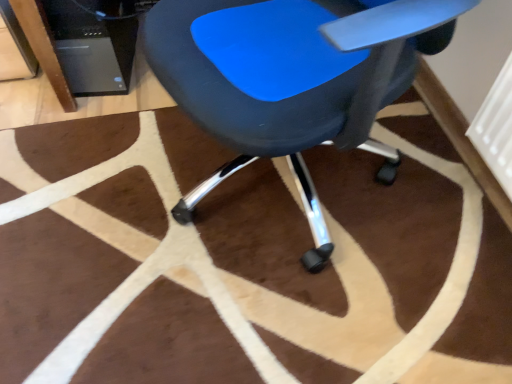
Question: Does blue plastic chair at center contain black plastic computer tower at upper left?

Choices:
 (A) no
 (B) yes

Answer: (A)

Question: Can you confirm if blue plastic chair at center is wider than black plastic computer tower at upper left?

Choices:
 (A) yes
 (B) no

Answer: (A)

Question: From a real-world perspective, is blue plastic chair at center positioned over black plastic computer tower at upper left based on gravity?

Choices:
 (A) no
 (B) yes

Answer: (B)

Question: Is blue plastic chair at center further to the viewer compared to black plastic computer tower at upper left?

Choices:
 (A) yes
 (B) no

Answer: (B)

Question: Does blue plastic chair at center have a lesser height compared to black plastic computer tower at upper left?

Choices:
 (A) yes
 (B) no

Answer: (B)

Question: From a real-world perspective, is brown fuzzy rug at center positioned above or below black plastic computer tower at upper left?

Choices:
 (A) below
 (B) above

Answer: (A)

Question: Would you say brown fuzzy rug at center is to the left or to the right of black plastic computer tower at upper left in the picture?

Choices:
 (A) left
 (B) right

Answer: (B)

Question: Is point (15, 357) positioned closer to the camera than point (100, 1)?

Choices:
 (A) closer
 (B) farther

Answer: (A)

Question: Considering the positions of brown fuzzy rug at center and black plastic computer tower at upper left in the image, is brown fuzzy rug at center wider or thinner than black plastic computer tower at upper left?

Choices:
 (A) wide
 (B) thin

Answer: (A)

Question: Relative to blue plastic chair at center, is brown fuzzy rug at center in front or behind?

Choices:
 (A) front
 (B) behind

Answer: (B)

Question: Is brown fuzzy rug at center situated inside blue plastic chair at center or outside?

Choices:
 (A) inside
 (B) outside

Answer: (B)

Question: Does point (287, 342) appear closer or farther from the camera than point (219, 130)?

Choices:
 (A) farther
 (B) closer

Answer: (A)

Question: Looking at the image, does brown fuzzy rug at center seem bigger or smaller compared to blue plastic chair at center?

Choices:
 (A) big
 (B) small

Answer: (B)

Question: Considering their positions, is blue plastic chair at center located in front of or behind black plastic computer tower at upper left?

Choices:
 (A) front
 (B) behind

Answer: (A)

Question: Considering the relative positions of blue plastic chair at center and black plastic computer tower at upper left in the image provided, is blue plastic chair at center to the left or to the right of black plastic computer tower at upper left?

Choices:
 (A) left
 (B) right

Answer: (B)